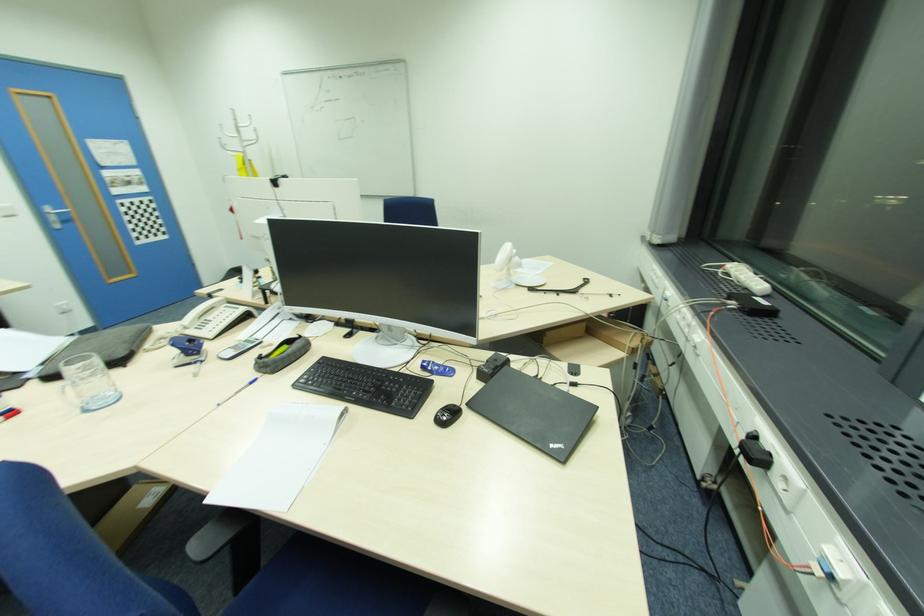
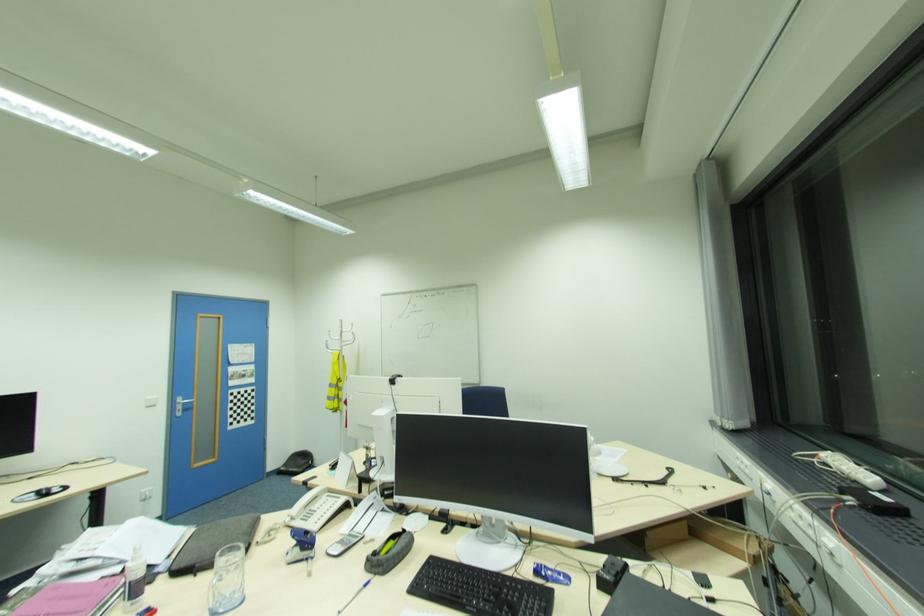
Question: How did the camera likely rotate?

Choices:
 (A) Left
 (B) Right
 (C) Up
 (D) Down

Answer: (C)